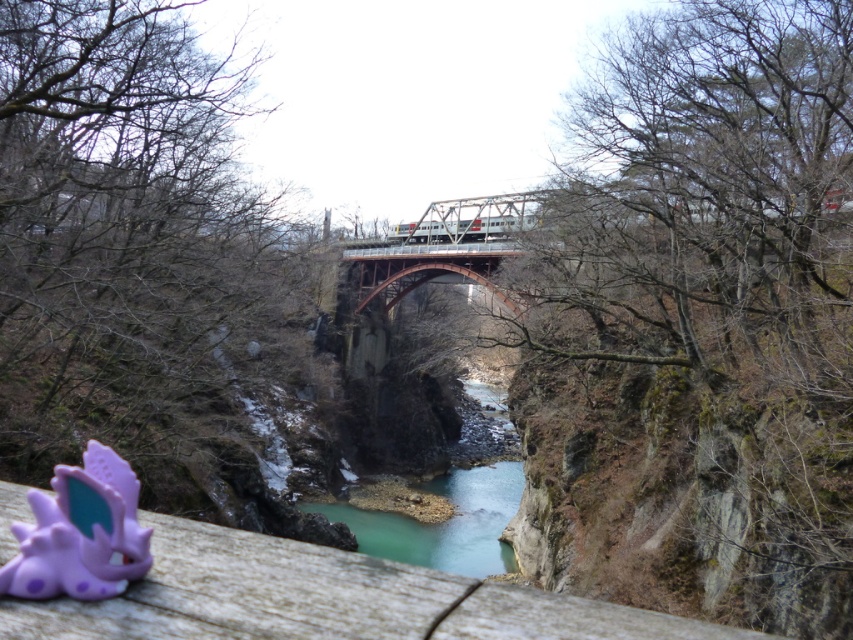
Question: Which is nearer to the purple matte toy at lower left?

Choices:
 (A) teal smooth water at center
 (B) wooden ledge at lower left

Answer: (B)

Question: Considering the relative positions of purple matte toy at lower left and teal smooth water at center in the image provided, where is purple matte toy at lower left located with respect to teal smooth water at center?

Choices:
 (A) below
 (B) above

Answer: (B)

Question: Which object appears closest to the camera in this image?

Choices:
 (A) wooden ledge at lower left
 (B) teal smooth water at center

Answer: (A)

Question: Does wooden ledge at lower left come in front of purple matte toy at lower left?

Choices:
 (A) yes
 (B) no

Answer: (A)

Question: Can you confirm if purple matte toy at lower left is bigger than teal smooth water at center?

Choices:
 (A) yes
 (B) no

Answer: (B)

Question: Among these points, which one is farthest from the camera?

Choices:
 (A) (490, 589)
 (B) (338, 515)

Answer: (B)